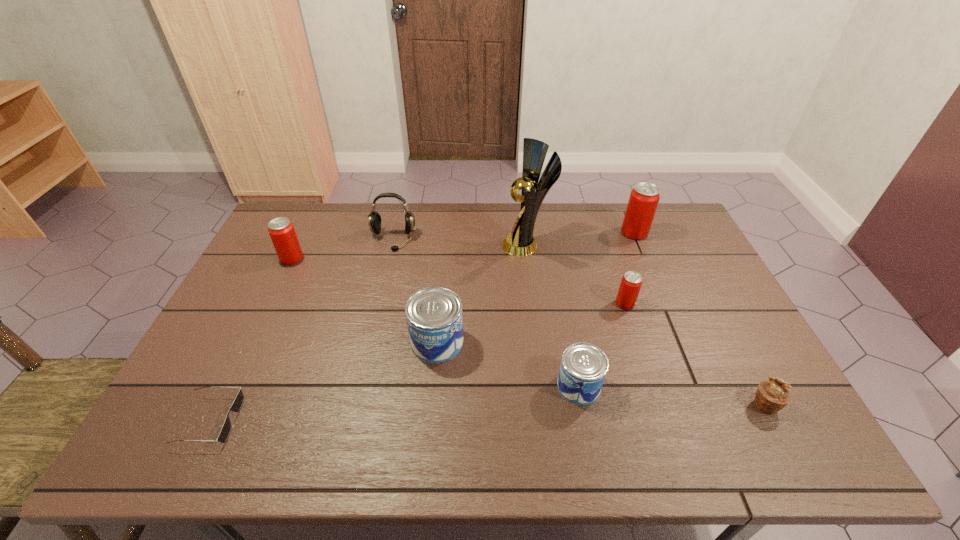
Where is `headset that is positioned at the far edge`? This screenshot has height=540, width=960. headset that is positioned at the far edge is located at coordinates (374, 220).

Where is `object present at the near edge`? object present at the near edge is located at coordinates (237, 404).

At what (x,y) coordinates should I click in order to perform the action: click on can that is at the left edge. Please return your answer as a coordinate pair (x, y). The image size is (960, 540). Looking at the image, I should click on (281, 230).

Where is `sunglasses located in the left edge section of the desktop`? The width and height of the screenshot is (960, 540). sunglasses located in the left edge section of the desktop is located at coordinates (237, 404).

What are the coordinates of `can that is at the right edge` in the screenshot? It's located at (644, 198).

You are a GUI agent. You are given a task and a screenshot of the screen. Output one action in this format:
    pyautogui.click(x=<x>, y=<y>)
    Task: Click on the muffin that is at the right edge
    The width and height of the screenshot is (960, 540).
    Given the screenshot: What is the action you would take?
    pyautogui.click(x=772, y=395)

Find the location of `object located in the near left corner section of the desktop`. object located in the near left corner section of the desktop is located at coordinates (237, 404).

At what (x,y) coordinates should I click in order to perform the action: click on object present at the far right corner. Please return your answer as a coordinate pair (x, y). Looking at the image, I should click on (644, 198).

In the image, there is a desktop. Identify the location of vacant space at the far edge. The image size is (960, 540). (616, 211).

The image size is (960, 540). I want to click on vacant space at the near edge, so click(x=537, y=455).